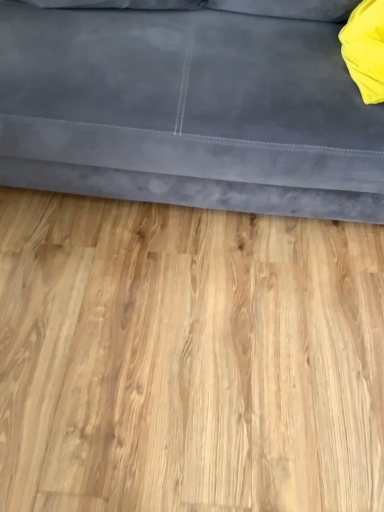
Question: Does point (365, 79) appear closer or farther from the camera than point (243, 347)?

Choices:
 (A) closer
 (B) farther

Answer: (A)

Question: Looking at their shapes, would you say yellow fabric pillow at upper right is wider or thinner than light wood flooring at center?

Choices:
 (A) thin
 (B) wide

Answer: (A)

Question: Estimate the real-world distances between objects in this image. Which object is farther from the light wood flooring at center?

Choices:
 (A) suede gray couch at upper center
 (B) yellow fabric pillow at upper right

Answer: (B)

Question: Estimate the real-world distances between objects in this image. Which object is closer to the yellow fabric pillow at upper right?

Choices:
 (A) suede gray couch at upper center
 (B) light wood flooring at center

Answer: (A)